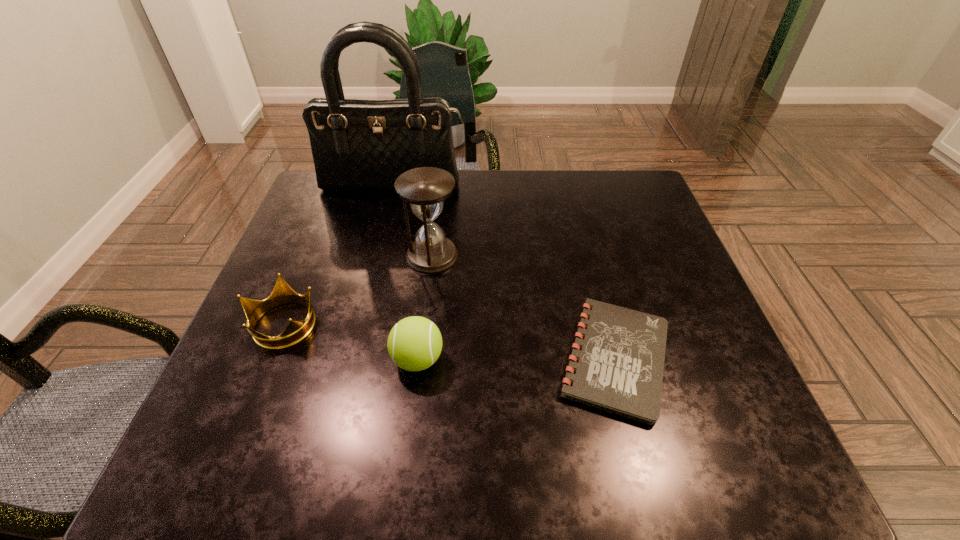
Where is `unoccupied area between the second tallest object and the crown`? This screenshot has height=540, width=960. unoccupied area between the second tallest object and the crown is located at coordinates (358, 289).

Where is `free space between the tennis ball and the crown`? The width and height of the screenshot is (960, 540). free space between the tennis ball and the crown is located at coordinates (350, 341).

Locate an element on the screen. The height and width of the screenshot is (540, 960). free space between the third shortest object and the fourth shortest object is located at coordinates (425, 307).

Identify the location of free spot between the third shortest object and the rightmost object. The width and height of the screenshot is (960, 540). (516, 359).

Where is `free space between the farthest object and the crown`? The height and width of the screenshot is (540, 960). free space between the farthest object and the crown is located at coordinates [338, 255].

Locate an element on the screen. the closest object to the hourglass is located at coordinates (296, 331).

Find the location of a particular element. object that is the second closest to the tallest object is located at coordinates [296, 331].

The width and height of the screenshot is (960, 540). What are the coordinates of `free space in the image that satisfies the following two spatial constraints: 1. with an open clasp on the front of the tallest object; 2. on the left side of the rightmost object` in the screenshot? It's located at (350, 359).

Locate an element on the screen. The height and width of the screenshot is (540, 960). free location that satisfies the following two spatial constraints: 1. on the back side of the crown; 2. on the right side of the second farthest object is located at coordinates (311, 256).

Locate an element on the screen. vacant position in the image that satisfies the following two spatial constraints: 1. on the front side of the hourglass; 2. on the right side of the rightmost object is located at coordinates (420, 359).